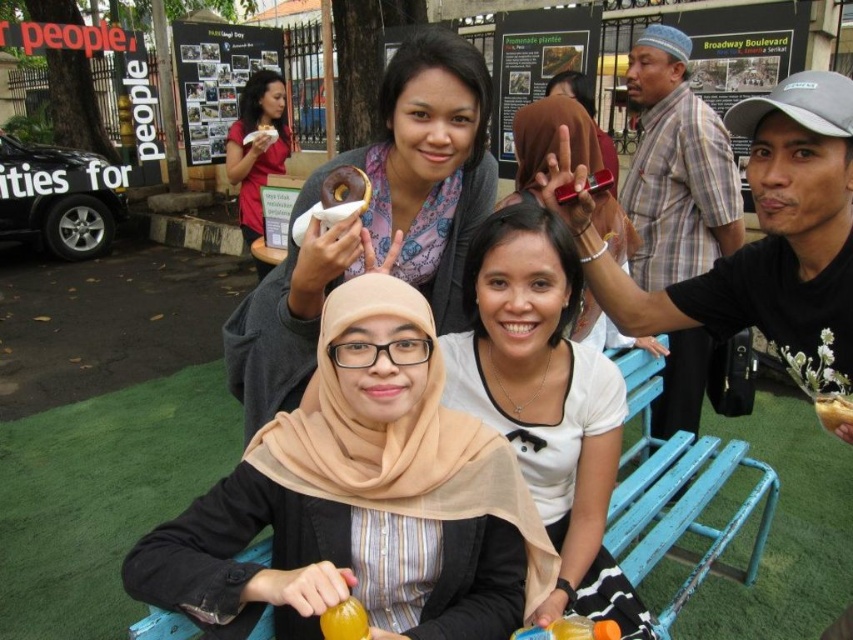
Question: Is matte beige hijab at center positioned at the back of matte pink donut at upper left?

Choices:
 (A) yes
 (B) no

Answer: (B)

Question: Which object is the farthest from the yellow matte donut at center?

Choices:
 (A) matte pink donut at upper left
 (B) brown glazed donut at center

Answer: (A)

Question: Which is farther from the matte brown donut at upper center?

Choices:
 (A) golden glazed donut at center
 (B) yellow matte donut at center
 (C) brown glazed donut at center
 (D) white matte shirt at center

Answer: (A)

Question: Which of the following is the farthest from the observer?

Choices:
 (A) matte brown donut at upper center
 (B) matte black phone at center

Answer: (B)

Question: Considering the relative positions of matte beige hijab at center and matte pink donut at upper left in the image provided, where is matte beige hijab at center located with respect to matte pink donut at upper left?

Choices:
 (A) right
 (B) left

Answer: (A)

Question: Where is matte black phone at center located in relation to brown glazed donut at center in the image?

Choices:
 (A) above
 (B) below

Answer: (B)